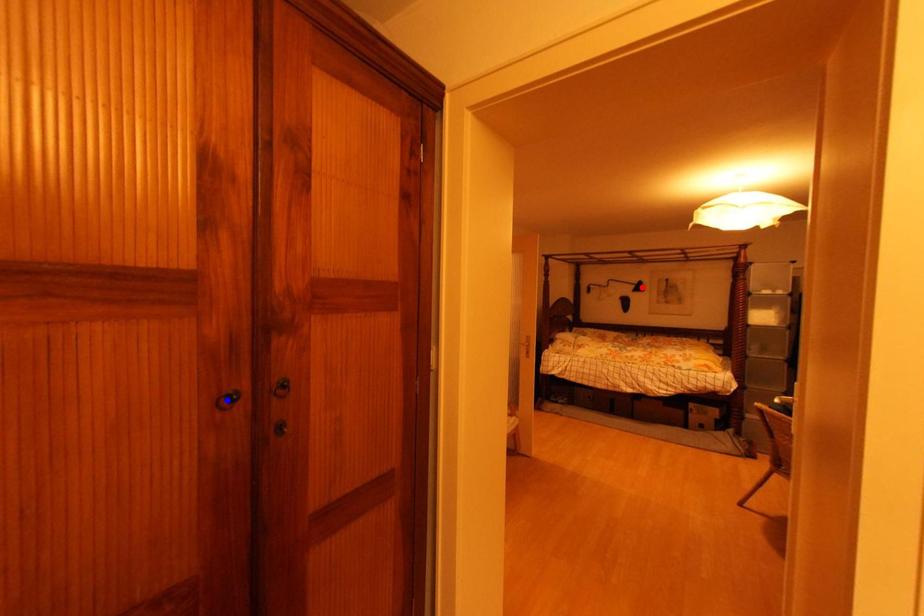
Question: In the image, two points are highlighted. Which point is nearer to the camera? Reply with the corresponding letter.

Choices:
 (A) blue point
 (B) red point

Answer: (A)